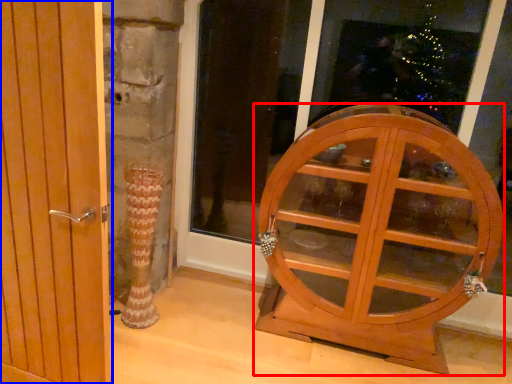
Question: Among these objects, which one is farthest to the camera, furniture (highlighted by a red box) or door (highlighted by a blue box)?

Choices:
 (A) furniture
 (B) door

Answer: (A)